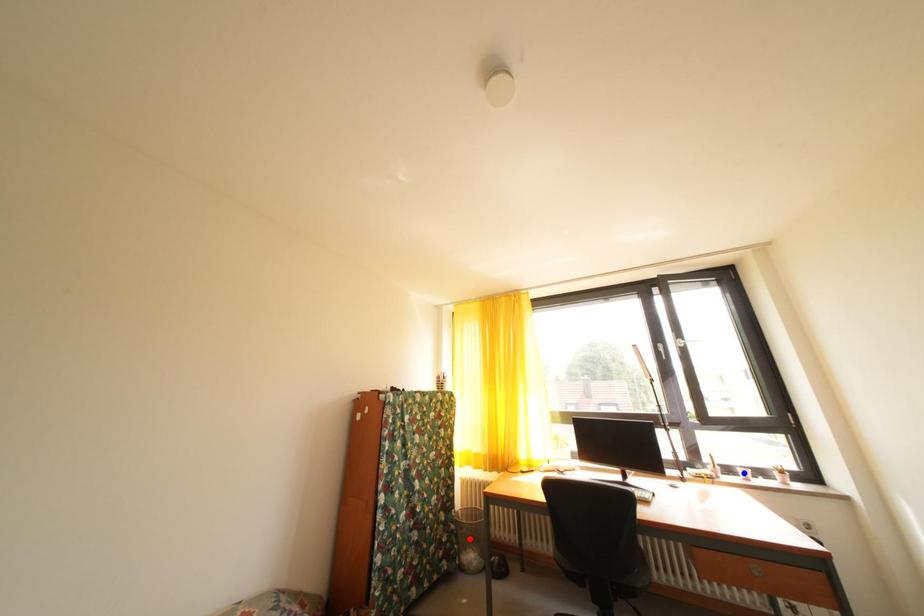
Question: Two points are marked on the image. Which point is closer to the camera?

Choices:
 (A) Blue point is closer.
 (B) Red point is closer.

Answer: (A)